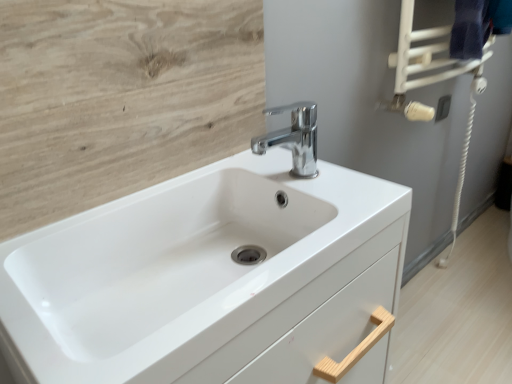
Question: Considering the relative sizes of light wood/texture at upper left and dark blue fabric towel bar at upper right in the image provided, is light wood/texture at upper left taller than dark blue fabric towel bar at upper right?

Choices:
 (A) yes
 (B) no

Answer: (A)

Question: Is light wood/texture at upper left bigger than dark blue fabric towel bar at upper right?

Choices:
 (A) no
 (B) yes

Answer: (A)

Question: Is light wood/texture at upper left positioned beyond the bounds of dark blue fabric towel bar at upper right?

Choices:
 (A) yes
 (B) no

Answer: (A)

Question: Could you tell me if light wood/texture at upper left is turned towards dark blue fabric towel bar at upper right?

Choices:
 (A) yes
 (B) no

Answer: (B)

Question: Is light wood/texture at upper left not close to dark blue fabric towel bar at upper right?

Choices:
 (A) yes
 (B) no

Answer: (B)

Question: Is light wood/texture at upper left at the right side of dark blue fabric towel bar at upper right?

Choices:
 (A) yes
 (B) no

Answer: (B)

Question: Is light wood/texture at upper left aimed at chrome metallic faucet at center?

Choices:
 (A) no
 (B) yes

Answer: (B)

Question: From a real-world perspective, is light wood/texture at upper left physically below chrome metallic faucet at center?

Choices:
 (A) no
 (B) yes

Answer: (A)

Question: Does light wood/texture at upper left come behind chrome metallic faucet at center?

Choices:
 (A) no
 (B) yes

Answer: (A)

Question: Can you confirm if light wood/texture at upper left is smaller than chrome metallic faucet at center?

Choices:
 (A) no
 (B) yes

Answer: (A)

Question: Would you say chrome metallic faucet at center is part of light wood/texture at upper left's contents?

Choices:
 (A) yes
 (B) no

Answer: (B)

Question: From the image's perspective, is light wood/texture at upper left over chrome metallic faucet at center?

Choices:
 (A) no
 (B) yes

Answer: (B)

Question: From the image's perspective, does chrome metallic faucet at center appear lower than white glossy sink at center?

Choices:
 (A) yes
 (B) no

Answer: (B)